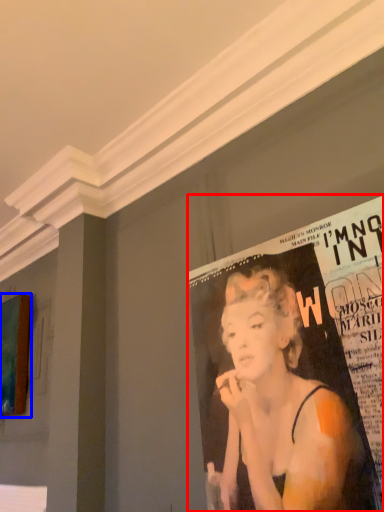
Question: Among these objects, which one is farthest to the camera, poster (highlighted by a red box) or advertisement (highlighted by a blue box)?

Choices:
 (A) poster
 (B) advertisement

Answer: (B)